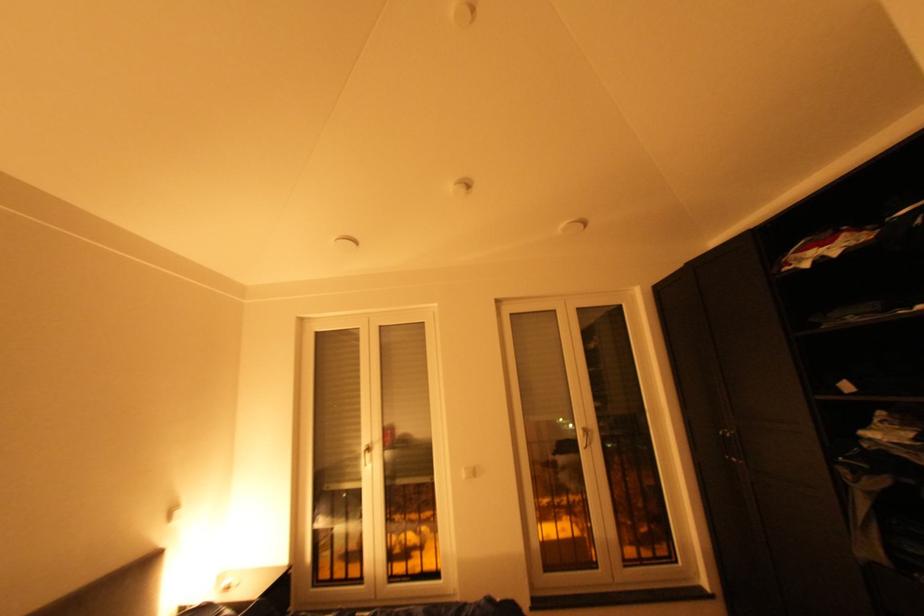
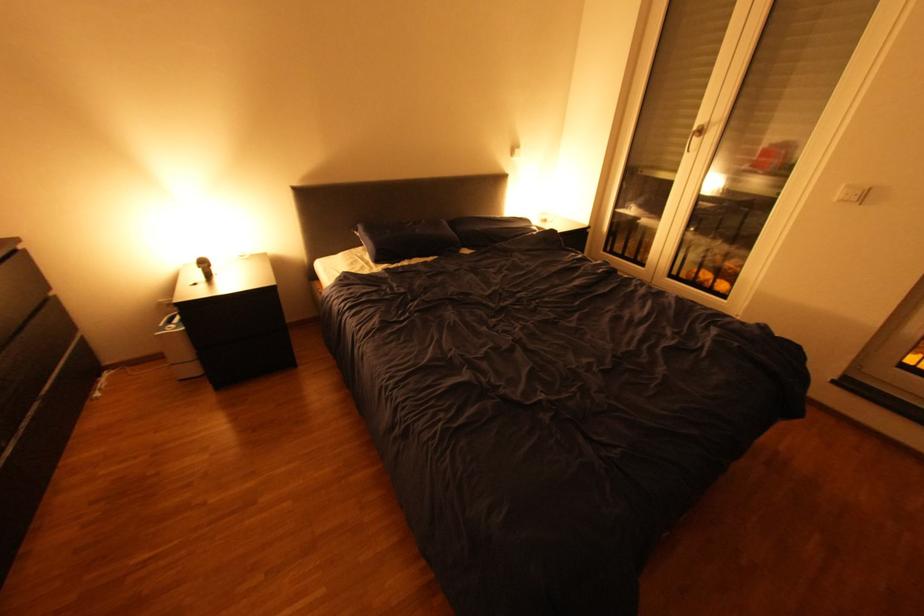
The images are taken continuously from a first-person perspective. In which direction is your viewpoint rotating?

The rotation direction of the camera is left-down.